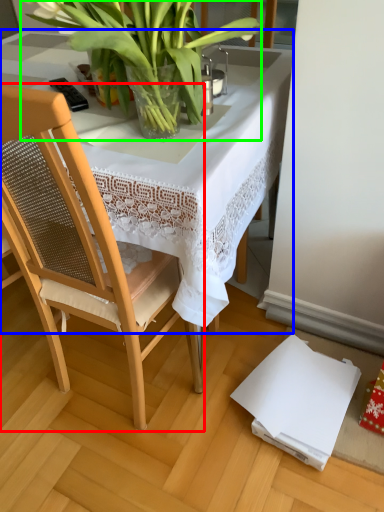
Question: Considering the real-world distances, which object is closest to chair (highlighted by a red box)? table (highlighted by a blue box) or houseplant (highlighted by a green box).

Choices:
 (A) table
 (B) houseplant

Answer: (A)